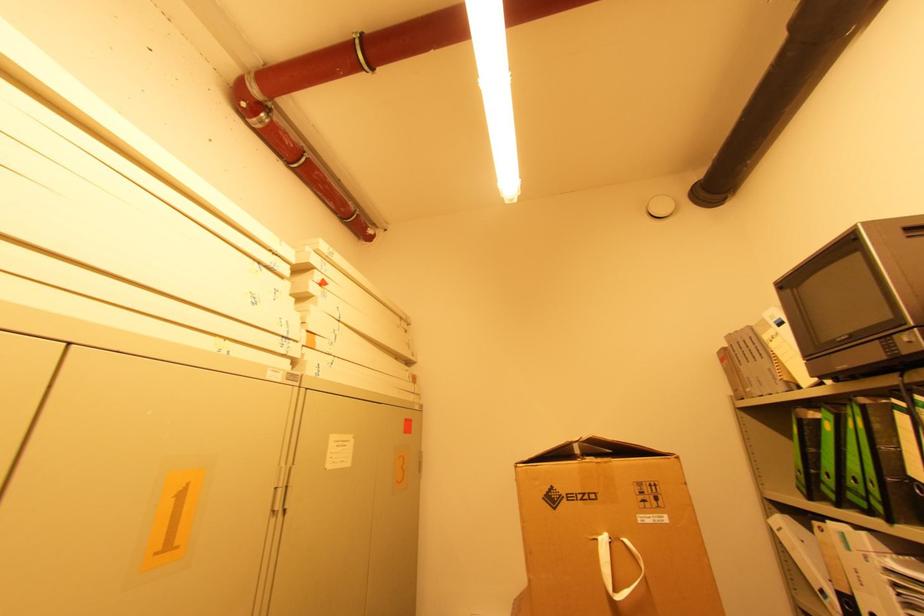
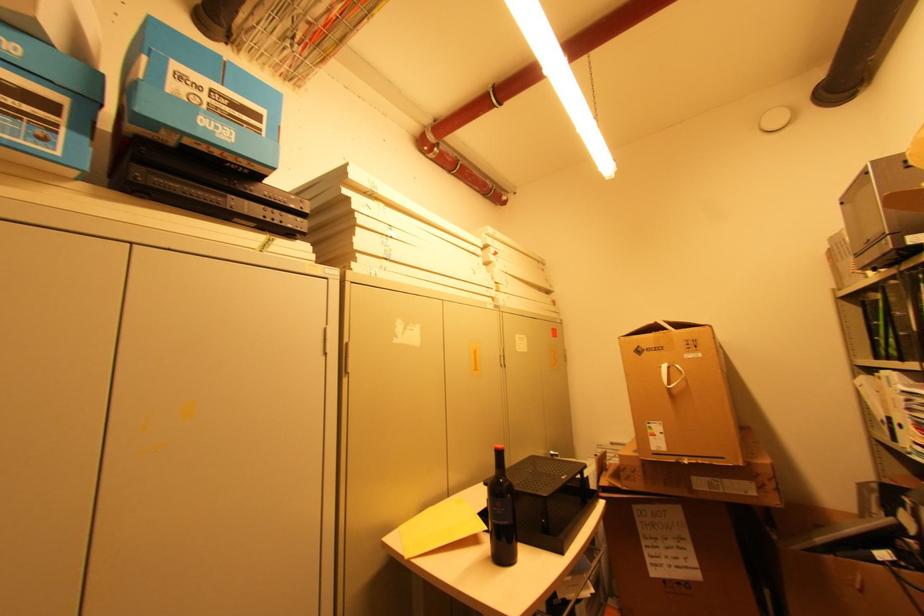
Question: The camera is either moving clockwise (left) or counter-clockwise (right) around the object. The first image is from the beginning of the video and the second image is from the end. Is the camera moving left or right when shooting the video?

Choices:
 (A) Left
 (B) Right

Answer: (B)